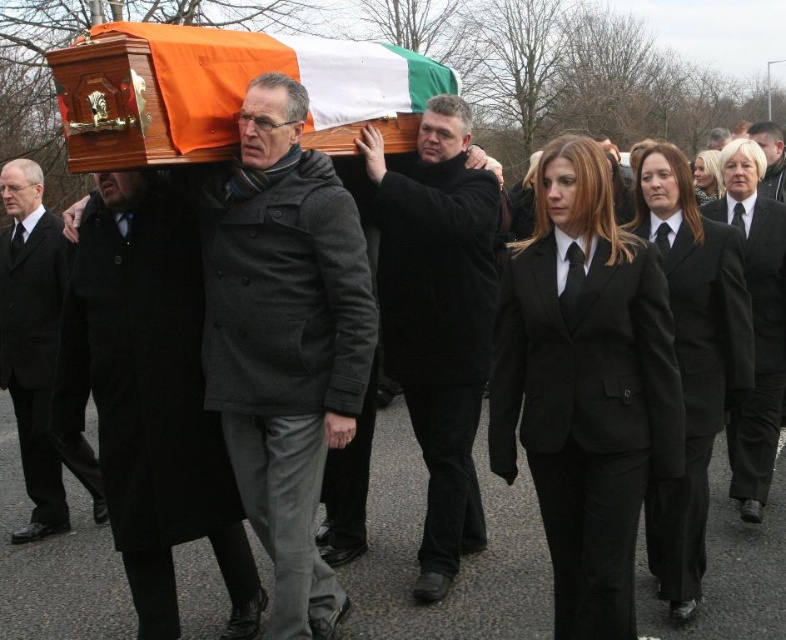
You are standing at the origin point in the image and want to find the black wool coat at center. In which direction should you look to locate it?

The black wool coat at center is located at point 0.633 on the x axis and 0.193 on the y axis, so you should look to the right and slightly downward from the origin point.

You are a photographer trying to capture the funeral procession. You notice the black wool coat at center and the black wool suit at left. Which one appears smaller in the photo?

The black wool coat at center appears smaller because it occupies less space than the black wool suit at left.